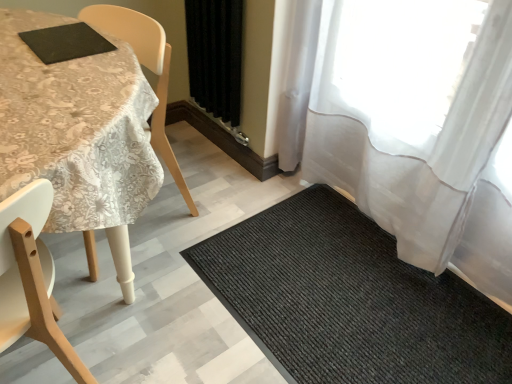
Question: From a real-world perspective, is wooden chair at left located beneath black textured mat at lower right?

Choices:
 (A) no
 (B) yes

Answer: (A)

Question: Is wooden chair at left surrounding black textured mat at lower right?

Choices:
 (A) no
 (B) yes

Answer: (A)

Question: Is wooden chair at left thinner than black textured mat at lower right?

Choices:
 (A) no
 (B) yes

Answer: (B)

Question: Is wooden chair at left to the right of black textured mat at lower right from the viewer's perspective?

Choices:
 (A) yes
 (B) no

Answer: (B)

Question: From a real-world perspective, is wooden chair at left physically above black textured mat at lower right?

Choices:
 (A) yes
 (B) no

Answer: (A)

Question: From the image's perspective, relative to black fabric curtain at center, positioned as the first curtain in left-to-right order, is black textured mat at lower right above or below?

Choices:
 (A) above
 (B) below

Answer: (B)

Question: From a real-world perspective, is black textured mat at lower right positioned above or below black fabric curtain at center, which ranks as the 2th curtain in right-to-left order?

Choices:
 (A) above
 (B) below

Answer: (B)

Question: Based on their positions, is black textured mat at lower right located to the left or right of black fabric curtain at center, which ranks as the 2th curtain in right-to-left order?

Choices:
 (A) left
 (B) right

Answer: (B)

Question: Do you think black textured mat at lower right is within black fabric curtain at center, which ranks as the 2th curtain in right-to-left order, or outside of it?

Choices:
 (A) inside
 (B) outside

Answer: (B)

Question: Visually, is wooden chair at left positioned to the left or to the right of black textured mat at lower right?

Choices:
 (A) right
 (B) left

Answer: (B)

Question: In terms of height, does wooden chair at left look taller or shorter compared to black textured mat at lower right?

Choices:
 (A) short
 (B) tall

Answer: (B)

Question: In terms of width, does wooden chair at left look wider or thinner when compared to black textured mat at lower right?

Choices:
 (A) wide
 (B) thin

Answer: (B)

Question: In the image, is wooden chair at left positioned in front of or behind black textured mat at lower right?

Choices:
 (A) behind
 (B) front

Answer: (B)

Question: Would you say black textured mat at lower right is inside or outside white lace tablecloth at upper left?

Choices:
 (A) inside
 (B) outside

Answer: (B)

Question: Is black textured mat at lower right to the left or to the right of white lace tablecloth at upper left in the image?

Choices:
 (A) left
 (B) right

Answer: (B)